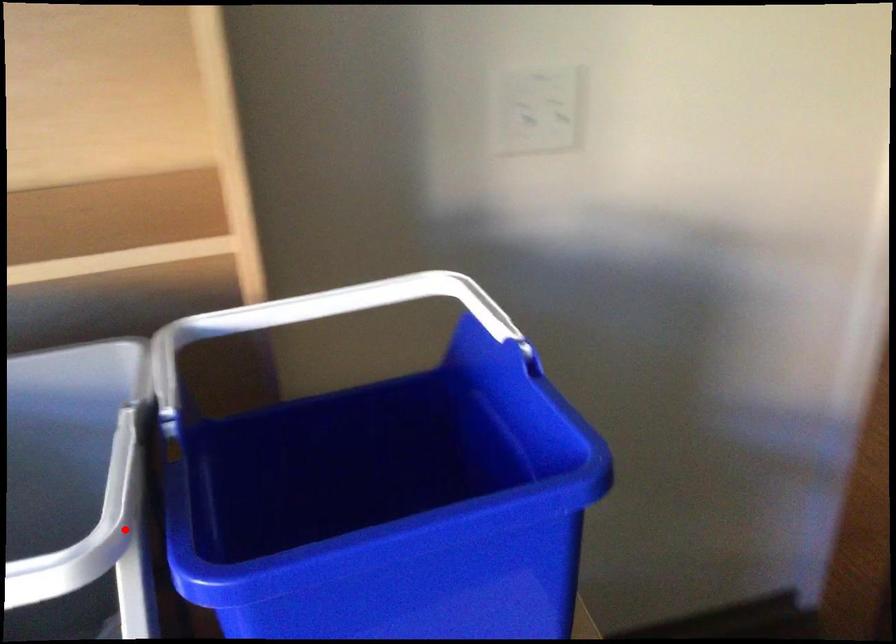
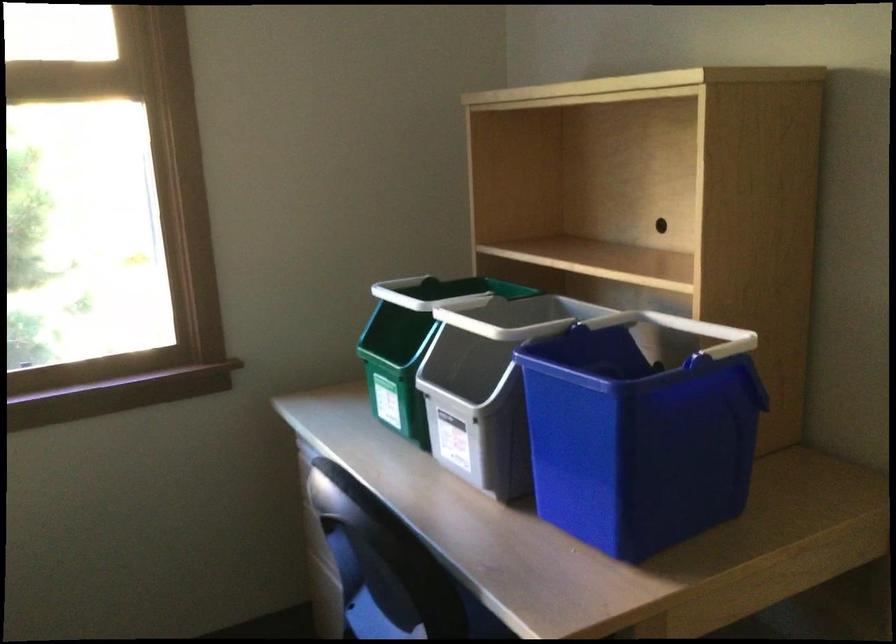
Question: I am providing you with two images of the same scene from different viewpoints. A red point is marked on the first image. Can you still see the location of the red point in image 2?

Choices:
 (A) Yes
 (B) No

Answer: (B)